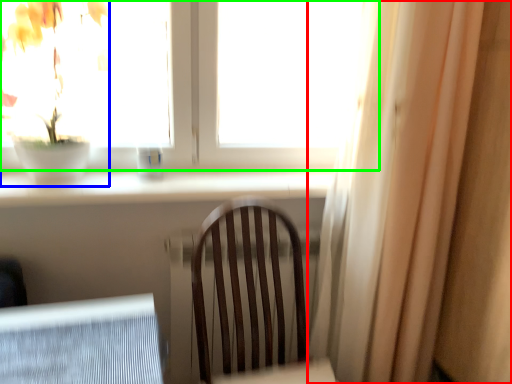
Question: Considering the real-world distances, which object is farthest from curtain (highlighted by a red box)? houseplant (highlighted by a blue box) or window (highlighted by a green box)?

Choices:
 (A) houseplant
 (B) window

Answer: (A)